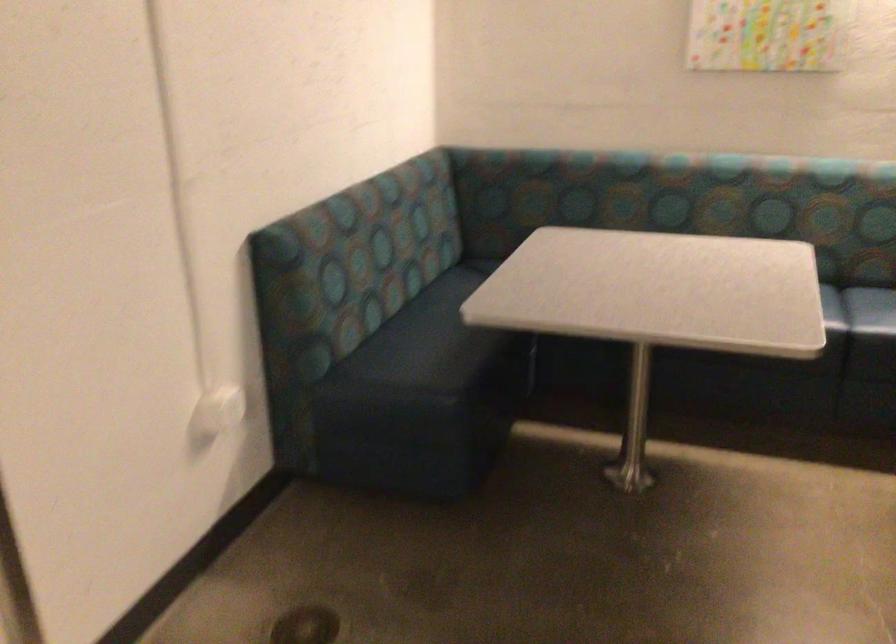
At what (x,y) coordinates should I click in order to perform the action: click on dark blue sofa sitting surface. Please return your answer as a coordinate pair (x, y). The height and width of the screenshot is (644, 896). Looking at the image, I should click on (440, 337).